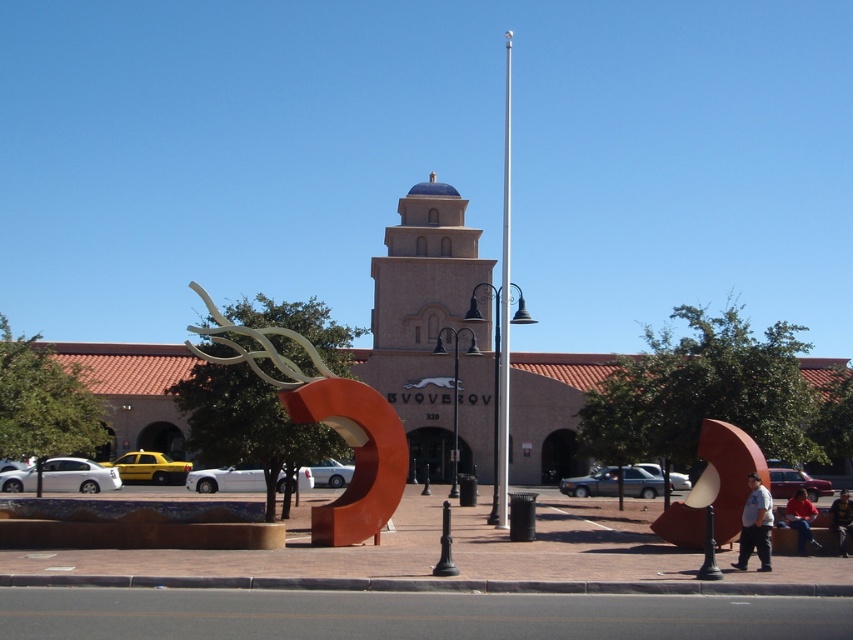
Can you confirm if light blue shirt at center is bigger than denim jacket at lower right?

No.

Is point (762, 520) farther from camera compared to point (793, 518)?

No, (762, 520) is in front of (793, 518).

Between point (735, 564) and point (795, 516), which one is positioned in front?

Point (735, 564)

I want to click on light blue shirt at center, so click(x=755, y=524).

Between point (296, 420) and point (846, 512), which one is positioned in front?

Positioned in front is point (846, 512).

Is point (312, 348) closer to camera compared to point (846, 502)?

No.

I want to click on rustic metal sculpture at center, so click(331, 428).

Who is shorter, silver metallic flag pole at center or denim jacket at lower right?

With less height is denim jacket at lower right.

Can you confirm if silver metallic flag pole at center is wider than denim jacket at lower right?

Yes, silver metallic flag pole at center is wider than denim jacket at lower right.

Which is in front, point (503, 381) or point (805, 516)?

Point (805, 516) is more forward.

Locate an element on the screen. The width and height of the screenshot is (853, 640). silver metallic flag pole at center is located at coordinates (503, 316).